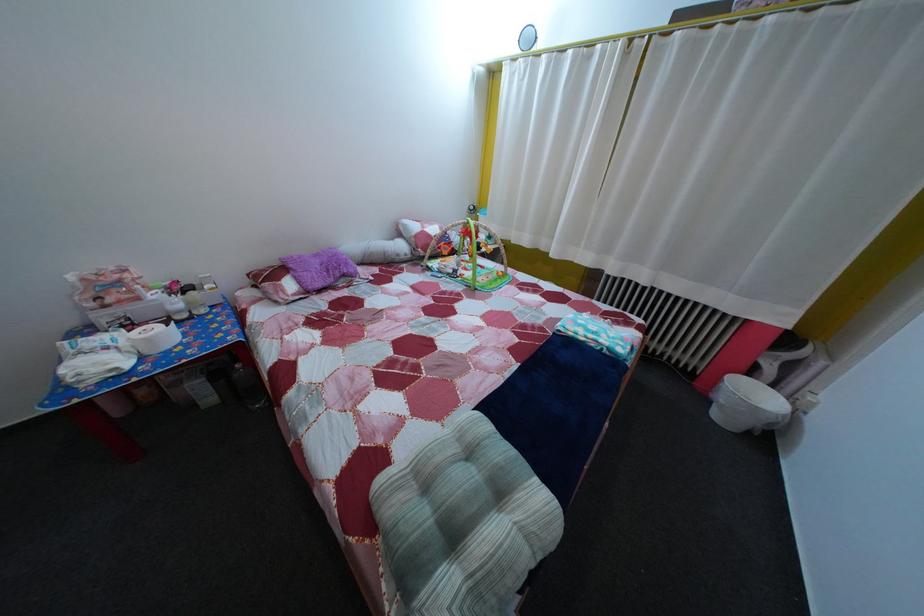
Find where to push the white pump dispenser. Please return your answer as a coordinate pair (x, y).

(209, 290)